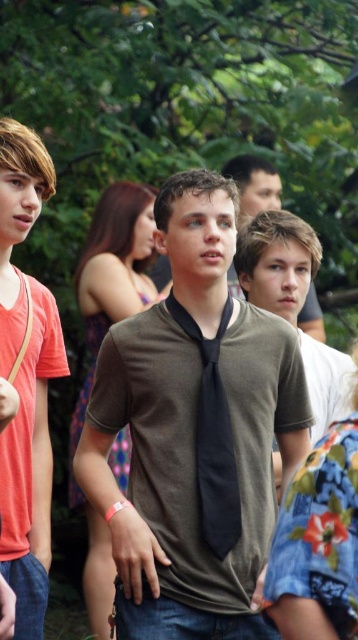
Question: Does matte brown shirt at center have a greater width compared to matte orange t-shirt at left?

Choices:
 (A) yes
 (B) no

Answer: (A)

Question: Which of the following is the farthest from the observer?

Choices:
 (A) matte brown shirt at center
 (B) matte orange t-shirt at left
 (C) black silk tie at center

Answer: (B)

Question: Can you confirm if matte brown shirt at center is bigger than matte orange t-shirt at left?

Choices:
 (A) no
 (B) yes

Answer: (B)

Question: Based on their relative distances, which object is farther from the matte orange t-shirt at left?

Choices:
 (A) matte brown shirt at center
 (B) black silk tie at center

Answer: (B)

Question: Is matte brown shirt at center bigger than matte green shirt at center?

Choices:
 (A) no
 (B) yes

Answer: (B)

Question: Which point is closer to the camera?

Choices:
 (A) black silk tie at center
 (B) matte brown shirt at center

Answer: (B)